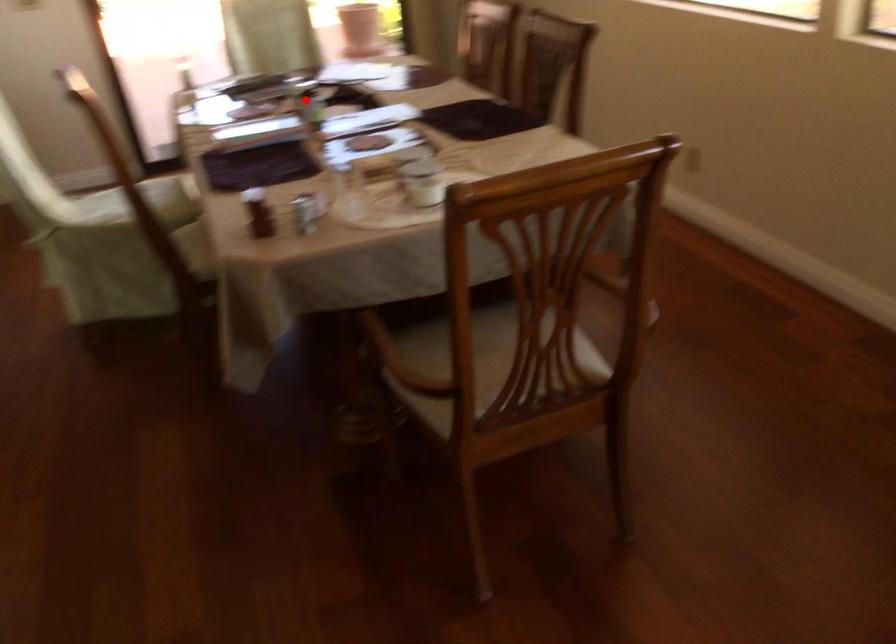
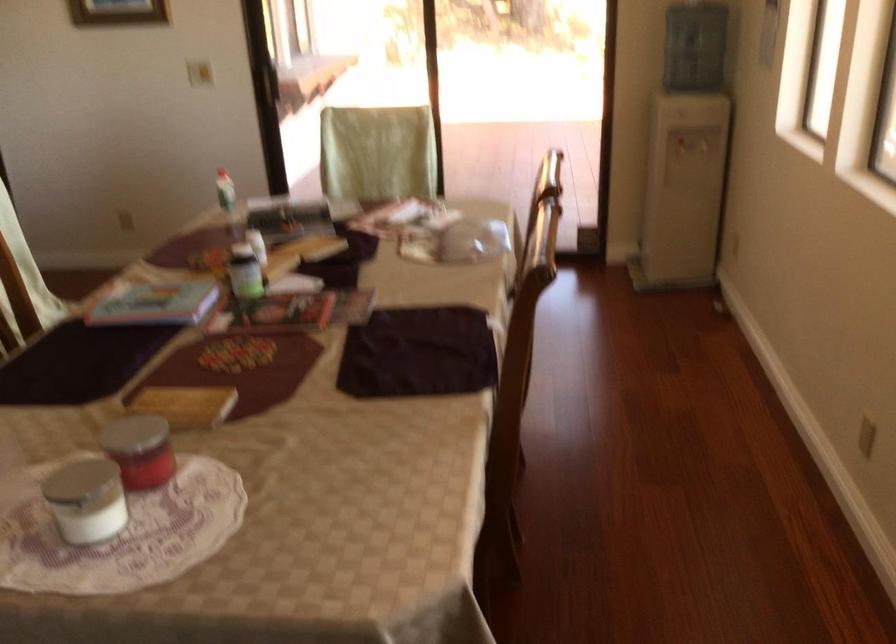
Question: I am providing you with two images of the same scene from different viewpoints. Image1 has a red point marked. In image2, the corresponding 3D location appears at what relative position? Reply with the corresponding letter.

Choices:
 (A) Closer
 (B) Farther

Answer: (A)